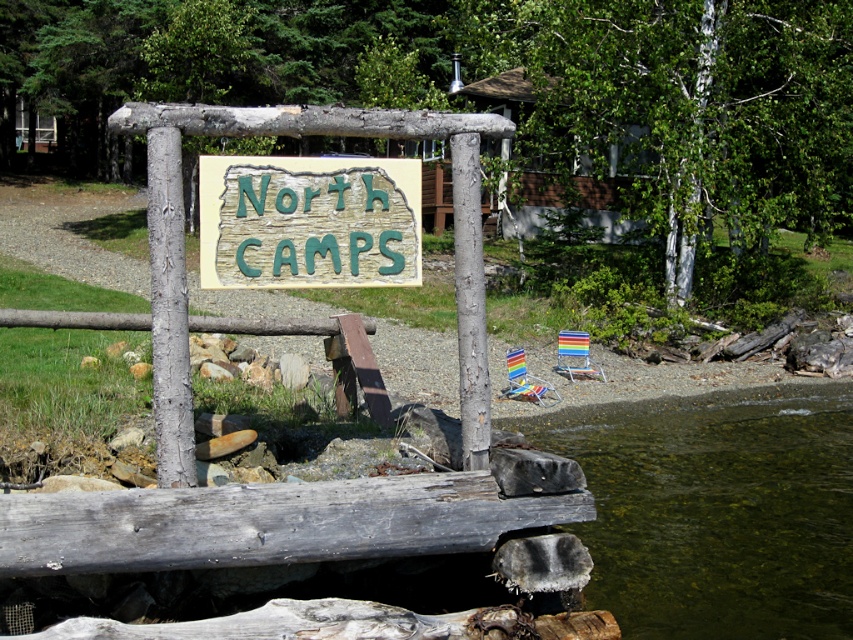
Between clear water at lower right and gray textured pole at center, which one appears on the right side from the viewer's perspective?

Positioned to the right is clear water at lower right.

Consider the image. Who is positioned more to the left, clear water at lower right or gray textured pole at center?

From the viewer's perspective, gray textured pole at center appears more on the left side.

The height and width of the screenshot is (640, 853). Identify the location of clear water at lower right. (717, 509).

Who is taller, green carved wood sign at center or gray textured pole at center?

gray textured pole at center

Is green carved wood sign at center taller than gray textured pole at center?

No, green carved wood sign at center is not taller than gray textured pole at center.

Is point (315, 196) positioned after point (178, 467)?

Yes, point (315, 196) is behind point (178, 467).

At what (x,y) coordinates should I click in order to perform the action: click on green carved wood sign at center. Please return your answer as a coordinate pair (x, y). Looking at the image, I should click on (308, 221).

Can you confirm if clear water at lower right is wider than weathered wood dock at lower center?

In fact, clear water at lower right might be narrower than weathered wood dock at lower center.

Between point (781, 538) and point (67, 493), which one is positioned in front?

Positioned in front is point (67, 493).

At what (x,y) coordinates should I click in order to perform the action: click on clear water at lower right. Please return your answer as a coordinate pair (x, y). Image resolution: width=853 pixels, height=640 pixels. Looking at the image, I should click on click(x=717, y=509).